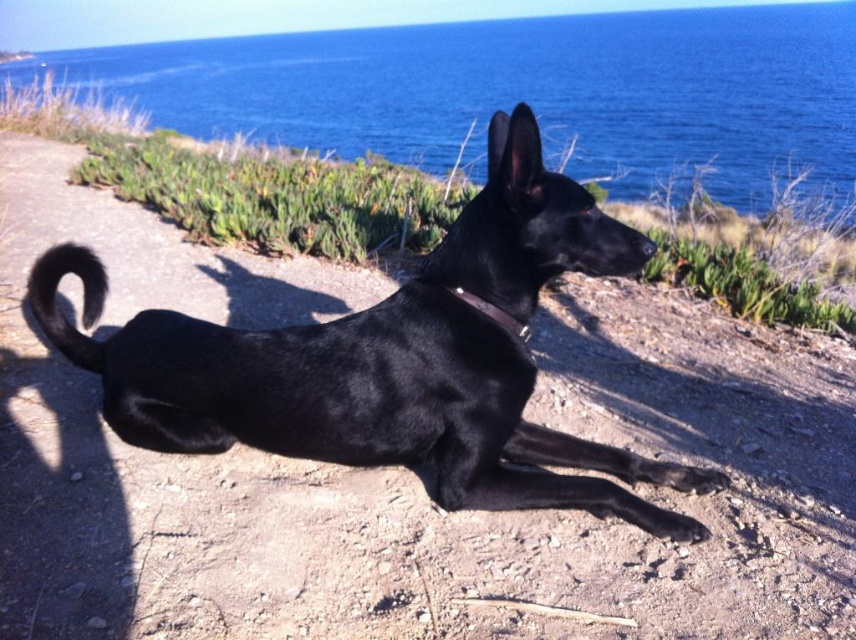
Between blue water at upper center and metallic silver neckband at center, which one has more height?

blue water at upper center is taller.

Is point (431, 163) closer to viewer compared to point (507, 321)?

No, it is not.

Is point (741, 170) positioned behind point (501, 324)?

Yes, it is behind point (501, 324).

Where is `blue water at upper center`? The height and width of the screenshot is (640, 856). blue water at upper center is located at coordinates (522, 92).

Does point (498, 300) lie behind point (413, 161)?

No.

Who is more forward, (x=568, y=202) or (x=247, y=76)?

Point (x=568, y=202) is more forward.

This screenshot has height=640, width=856. I want to click on black smooth dog at center, so 391,358.

Where is `black smooth dog at center`? black smooth dog at center is located at coordinates (391, 358).

Does black smooth dog at center have a smaller size compared to metallic silver neckband at center?

Actually, black smooth dog at center might be larger than metallic silver neckband at center.

Who is more forward, (182, 378) or (455, 292)?

Positioned in front is point (455, 292).

This screenshot has width=856, height=640. I want to click on black smooth dog at center, so click(x=391, y=358).